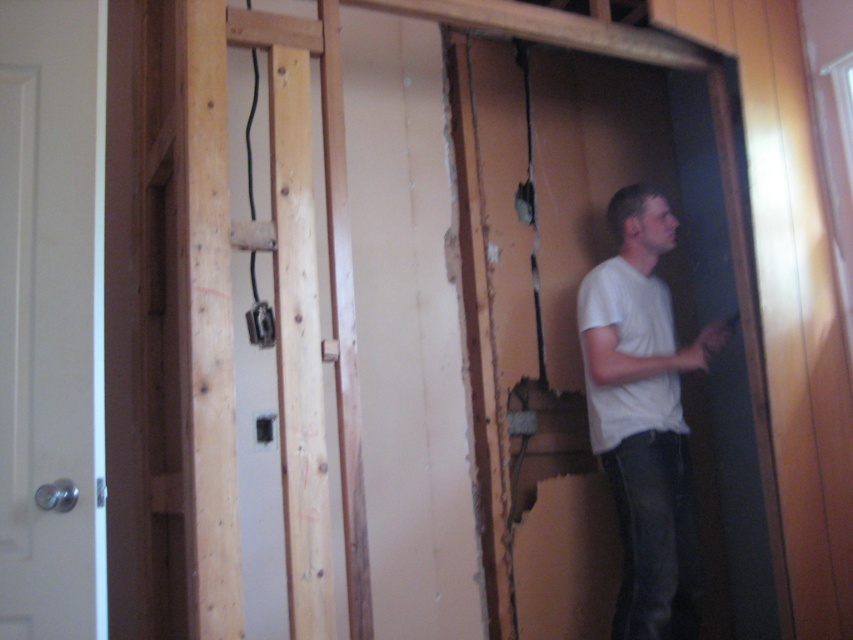
Question: Among these objects, which one is nearest to the camera?

Choices:
 (A) white matte door at left
 (B) white cotton shirt at right

Answer: (A)

Question: Does white matte door at left appear under white cotton shirt at right?

Choices:
 (A) yes
 (B) no

Answer: (B)

Question: Among these objects, which one is nearest to the camera?

Choices:
 (A) white cotton shirt at right
 (B) white matte shirt at center
 (C) white matte door at left

Answer: (C)

Question: Does white cotton shirt at right lie in front of white matte shirt at center?

Choices:
 (A) yes
 (B) no

Answer: (A)

Question: Is white cotton shirt at right above white matte shirt at center?

Choices:
 (A) no
 (B) yes

Answer: (A)

Question: Which is nearer to the white cotton shirt at right?

Choices:
 (A) white matte shirt at center
 (B) white matte door at left

Answer: (A)